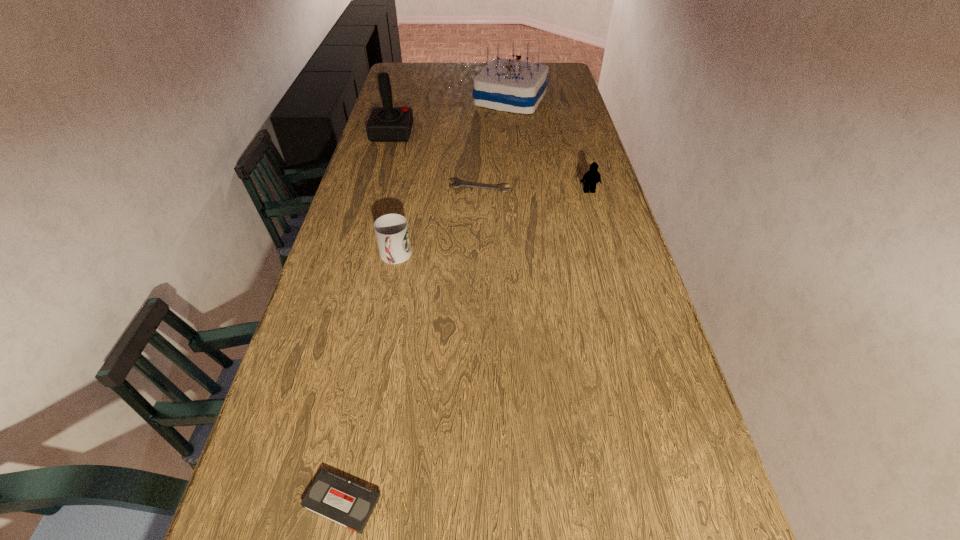
Find the location of `vacant space at the right edge of the desktop`. vacant space at the right edge of the desktop is located at coordinates (559, 97).

At what (x,y) coordinates should I click in order to perform the action: click on vacant point located between the cup and the shortest object. Please return your answer as a coordinate pair (x, y). The image size is (960, 540). Looking at the image, I should click on (437, 222).

You are a GUI agent. You are given a task and a screenshot of the screen. Output one action in this format:
    pyautogui.click(x=<x>, y=<y>)
    Task: Click on the empty space that is in between the wrench and the farthest object
    This screenshot has width=960, height=540.
    Given the screenshot: What is the action you would take?
    pyautogui.click(x=495, y=143)

What are the coordinates of `empty space between the wrench and the joystick` in the screenshot? It's located at (436, 160).

Identify the location of unoccupied area between the farthest object and the shortest object. Image resolution: width=960 pixels, height=540 pixels. (495, 143).

Locate an element on the screen. vacant area between the fifth nearest object and the nearest object is located at coordinates (367, 317).

Image resolution: width=960 pixels, height=540 pixels. I want to click on empty space between the fifth nearest object and the farthest object, so click(451, 116).

The image size is (960, 540). I want to click on unoccupied position between the farthest object and the second farthest object, so click(x=451, y=116).

Locate an element on the screen. free space between the videotape and the cup is located at coordinates (369, 380).

Locate an element on the screen. free space between the nearest object and the fifth nearest object is located at coordinates (367, 317).